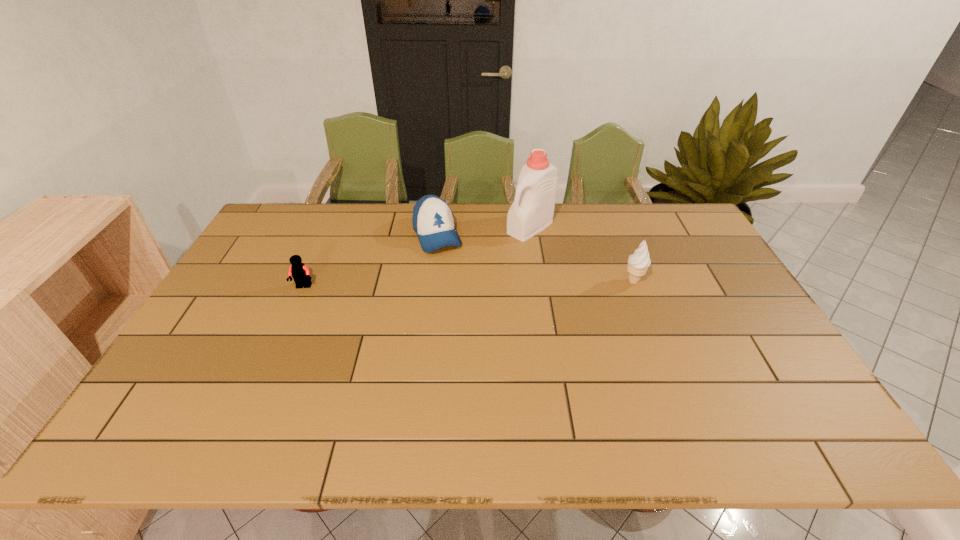
You are a GUI agent. You are given a task and a screenshot of the screen. Output one action in this format:
    pyautogui.click(x=<x>, y=<y>)
    Task: Click on the vacant area between the second tallest object and the tallest object
    This screenshot has height=540, width=960.
    Given the screenshot: What is the action you would take?
    pyautogui.click(x=582, y=254)

The height and width of the screenshot is (540, 960). Identify the location of vacant space in between the icecream and the leftmost object. (468, 284).

This screenshot has width=960, height=540. Identify the location of the second closest object relative to the Lego. (532, 211).

The width and height of the screenshot is (960, 540). I want to click on object that is the third closest to the third object from right to left, so click(638, 263).

Locate an element on the screen. The width and height of the screenshot is (960, 540). free spot that satisfies the following two spatial constraints: 1. on the front side of the rightmost object; 2. on the front-facing side of the third object from left to right is located at coordinates click(538, 281).

I want to click on free region that satisfies the following two spatial constraints: 1. on the back side of the detergent; 2. on the left side of the baseball cap, so click(x=438, y=227).

What are the coordinates of `free location that satisfies the following two spatial constraints: 1. on the front side of the icecream; 2. on the front-facing side of the tallest object` in the screenshot? It's located at (538, 281).

Where is `vacant space that satisfies the following two spatial constraints: 1. on the front side of the second object from left to right; 2. on the front-facing side of the rightmost object`? vacant space that satisfies the following two spatial constraints: 1. on the front side of the second object from left to right; 2. on the front-facing side of the rightmost object is located at coordinates (431, 281).